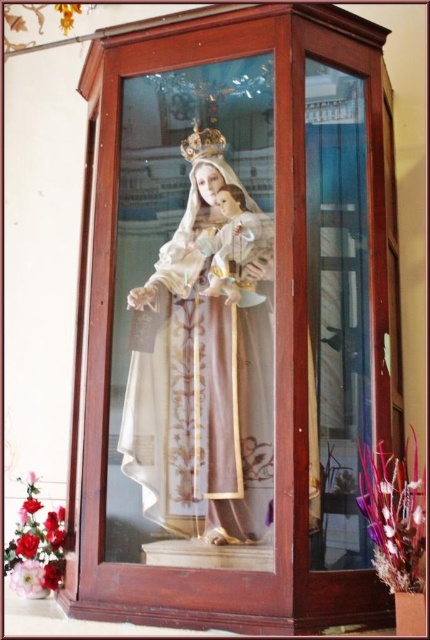
Question: Among these objects, which one is nearest to the camera?

Choices:
 (A) matte gold robe at center
 (B) gold metallic crown at upper center

Answer: (A)

Question: Is matte gold robe at center further to camera compared to gold metallic crown at upper center?

Choices:
 (A) yes
 (B) no

Answer: (B)

Question: Among these points, which one is nearest to the camera?

Choices:
 (A) (208, 141)
 (B) (266, 417)

Answer: (B)

Question: Is matte gold robe at center closer to camera compared to gold metallic crown at upper center?

Choices:
 (A) yes
 (B) no

Answer: (A)

Question: Can you confirm if matte gold robe at center is positioned to the right of gold metallic crown at upper center?

Choices:
 (A) no
 (B) yes

Answer: (B)